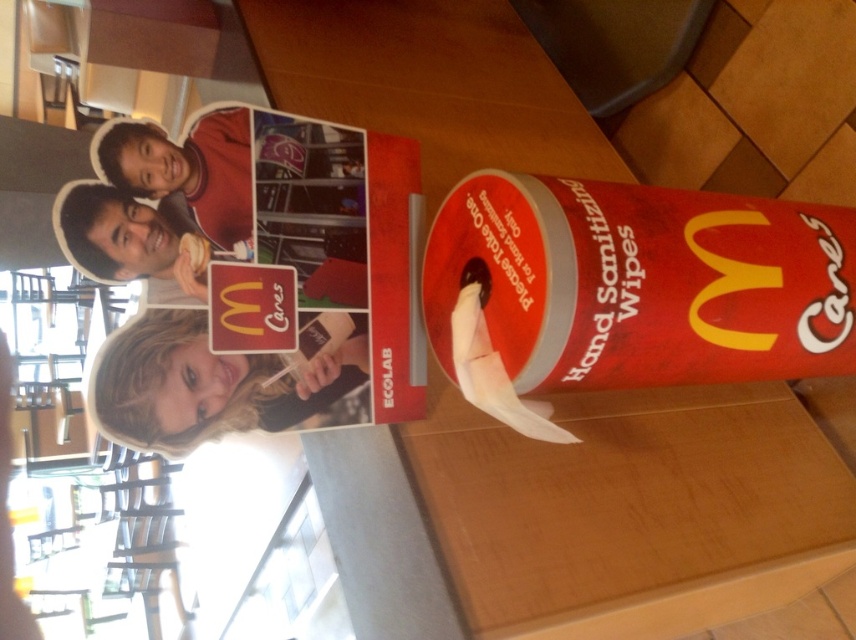
Is point (310, 145) closer to camera compared to point (239, 428)?

No, it is not.

Which is below, matte cardboard magazine at upper left or blonde hair at upper left?

blonde hair at upper left

Is point (260, 236) farther from camera compared to point (260, 372)?

Yes, it is behind point (260, 372).

The width and height of the screenshot is (856, 640). Identify the location of matte cardboard magazine at upper left. (262, 276).

Who is higher up, wooden table at center or blonde hair at upper left?

blonde hair at upper left is higher up.

Can you confirm if wooden table at center is positioned above blonde hair at upper left?

Incorrect, wooden table at center is not positioned above blonde hair at upper left.

Find the location of a particular element. wooden table at center is located at coordinates (632, 509).

Is point (170, 179) positioned behind point (569, 435)?

Yes.

Is matte black headband at upper left bigger than white paper at center?

Indeed, matte black headband at upper left has a larger size compared to white paper at center.

Does point (210, 128) come in front of point (461, 296)?

That is False.

The height and width of the screenshot is (640, 856). In order to click on matte black headband at upper left in this screenshot , I will do `click(187, 168)`.